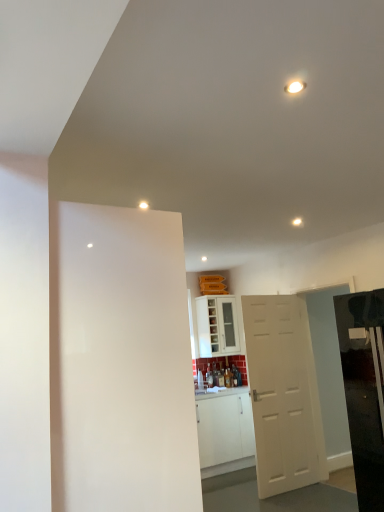
Find the location of a particular element. The height and width of the screenshot is (512, 384). white matte door at left, which is the 2th door from right to left is located at coordinates (122, 364).

Where is `white glossy cabinet at center`? This screenshot has height=512, width=384. white glossy cabinet at center is located at coordinates (217, 326).

This screenshot has height=512, width=384. Describe the element at coordinates (364, 390) in the screenshot. I see `glossy black refrigerator at right` at that location.

The width and height of the screenshot is (384, 512). I want to click on white matte door at center, positioned as the 1th door in back-to-front order, so click(x=283, y=394).

Would you consider white glossy light at upper center to be distant from glossy black refrigerator at right?

white glossy light at upper center is far away from glossy black refrigerator at right.

Based on their positions, is white glossy light at upper center located to the left or right of glossy black refrigerator at right?

Clearly, white glossy light at upper center is on the left of glossy black refrigerator at right in the image.

Does white glossy light at upper center have a greater width compared to glossy black refrigerator at right?

No.

Is white glossy light at upper center shorter than glossy black refrigerator at right?

Correct, white glossy light at upper center is not as tall as glossy black refrigerator at right.

Is point (369, 494) closer to viewer compared to point (147, 214)?

No, it is behind (147, 214).

Considering the relative positions of glossy black refrigerator at right and white matte door at left, which appears as the first door when viewed from the front, in the image provided, is glossy black refrigerator at right to the right of white matte door at left, which appears as the first door when viewed from the front, from the viewer's perspective?

Correct, you'll find glossy black refrigerator at right to the right of white matte door at left, which appears as the first door when viewed from the front.

Considering the relative sizes of glossy black refrigerator at right and white matte door at left, the 1th door positioned from the left, in the image provided, is glossy black refrigerator at right smaller than white matte door at left, the 1th door positioned from the left,?

Actually, glossy black refrigerator at right might be larger than white matte door at left, the 1th door positioned from the left.

From a real-world perspective, is glossy black refrigerator at right beneath white matte door at left, which appears as the first door when viewed from the front?

Correct, in the physical world, glossy black refrigerator at right is lower than white matte door at left, which appears as the first door when viewed from the front.

Is point (263, 472) closer to viewer compared to point (363, 409)?

No, it is not.

Is white matte door at center, positioned as the 1th door in back-to-front order, inside or outside of glossy black refrigerator at right?

white matte door at center, positioned as the 1th door in back-to-front order, cannot be found inside glossy black refrigerator at right.

Find the location of `door directly beneath the glossy black refrigerator at right (from a real-world perspective)`. door directly beneath the glossy black refrigerator at right (from a real-world perspective) is located at coordinates (283, 394).

Could you tell me if white matte door at center, positioned as the 1th door in back-to-front order, is turned towards glossy black refrigerator at right?

Yes, white matte door at center, positioned as the 1th door in back-to-front order, is oriented towards glossy black refrigerator at right.

Measure the distance from white matte door at center, positioned as the 1th door in back-to-front order, to white glossy light at upper center.

8.86 feet.

From the image's perspective, which is below, white matte door at center, the second door positioned from the front, or white glossy light at upper center?

white matte door at center, the second door positioned from the front, is shown below in the image.

Between white matte door at center, arranged as the second door when viewed from the left, and white glossy light at upper center, which one has larger size?

With larger size is white matte door at center, arranged as the second door when viewed from the left.

Which object is more forward, white matte door at center, the second door positioned from the front, or white glossy light at upper center?

Positioned in front is white glossy light at upper center.

I want to click on door on the right of white glossy light at upper center, so click(283, 394).

Does white glossy light at upper center touch white matte door at center, the second door positioned from the front?

They are not placed beside each other.

From the picture: Is white glossy light at upper center smaller than white matte door at center, positioned as the 1th door in back-to-front order?

Yes, white glossy light at upper center is smaller than white matte door at center, positioned as the 1th door in back-to-front order.

How many degrees apart are the facing directions of white glossy light at upper center and white matte door at center, arranged as the second door when viewed from the left?

They differ by 2.49 degrees in their facing directions.

Is the position of white glossy cabinet at center more distant than that of white matte door at left, which is the 2th door from right to left?

Yes, it is behind white matte door at left, which is the 2th door from right to left.

From the image's perspective, is white glossy cabinet at center located above white matte door at left, which is the 2th door from right to left?

No, from the image's perspective, white glossy cabinet at center is not over white matte door at left, which is the 2th door from right to left.

Does point (204, 306) appear closer or farther from the camera than point (128, 369)?

Point (204, 306) is farther from the camera than point (128, 369).

Between white glossy cabinet at center and white matte door at left, which is the 2th door from right to left, which one appears on the left side from the viewer's perspective?

Positioned to the left is white matte door at left, which is the 2th door from right to left.

Considering the relative sizes of white glossy light at upper center and white glossy cabinet at center in the image provided, is white glossy light at upper center smaller than white glossy cabinet at center?

Indeed, white glossy light at upper center has a smaller size compared to white glossy cabinet at center.

Looking at this image, from a real-world perspective, is white glossy light at upper center located beneath white glossy cabinet at center?

Actually, white glossy light at upper center is physically above white glossy cabinet at center in the real world.

From the image's perspective, is white glossy light at upper center on white glossy cabinet at center?

Correct, white glossy light at upper center appears higher than white glossy cabinet at center in the image.

Does point (141, 204) lie behind point (201, 336)?

No, it is not.

The image size is (384, 512). Identify the location of appliance located below the white glossy light at upper center (from the image's perspective). (364, 390).

The image size is (384, 512). What are the coordinates of `door above the glossy black refrigerator at right (from the image's perspective)` in the screenshot? It's located at (122, 364).

In the scene shown: When comparing their distances from white glossy light at upper center, does white matte door at left, which appears as the first door when viewed from the front, or white glossy cabinet at center seem further?

The object further to white glossy light at upper center is white glossy cabinet at center.

When comparing their distances from white matte door at left, which appears as the first door when viewed from the front, does white glossy light at upper center or glossy black refrigerator at right seem further?

The object further to white matte door at left, which appears as the first door when viewed from the front, is glossy black refrigerator at right.

Looking at the image, which one is located closer to white matte door at center, arranged as the 1th door when viewed from the right, white matte door at left, the 2th door positioned from the back, or white glossy light at upper center?

The object closer to white matte door at center, arranged as the 1th door when viewed from the right, is white glossy light at upper center.

Considering their positions, is white matte door at center, positioned as the 1th door in back-to-front order, positioned closer to white glossy cabinet at center than white matte door at left, the 2th door positioned from the back?

white matte door at center, positioned as the 1th door in back-to-front order, lies closer to white glossy cabinet at center than the other object.

Based on their spatial positions, is white matte door at left, which is the 2th door from right to left, or white glossy cabinet at center closer to glossy black refrigerator at right?

The object closer to glossy black refrigerator at right is white matte door at left, which is the 2th door from right to left.

From the image, which object appears to be nearer to white matte door at center, the second door positioned from the front, glossy black refrigerator at right or white matte door at left, the 2th door positioned from the back?

glossy black refrigerator at right is positioned closer to the anchor white matte door at center, the second door positioned from the front.

When comparing their distances from white matte door at center, positioned as the 1th door in back-to-front order, does white glossy light at upper center or white glossy cabinet at center seem closer?

white glossy cabinet at center.

Looking at the image, which one is located further to white matte door at center, positioned as the 1th door in back-to-front order, white glossy cabinet at center or white glossy light at upper center?

white glossy light at upper center is further to white matte door at center, positioned as the 1th door in back-to-front order.

I want to click on appliance between white matte door at left, the 1th door positioned from the left, and white matte door at center, positioned as the 1th door in back-to-front order, from front to back, so click(x=364, y=390).

Where is `door between glossy black refrigerator at right and white glossy cabinet at center from front to back`? The width and height of the screenshot is (384, 512). door between glossy black refrigerator at right and white glossy cabinet at center from front to back is located at coordinates (283, 394).

In order to click on door between white glossy light at upper center and white glossy cabinet at center in the front-back direction in this screenshot , I will do `click(283, 394)`.

Locate an element on the screen. The width and height of the screenshot is (384, 512). door located between white matte door at left, the 1th door positioned from the left, and white glossy cabinet at center in the depth direction is located at coordinates (283, 394).